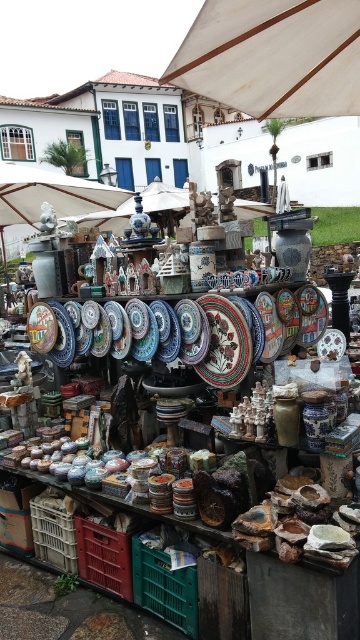
You are a customer at the market stall and want to place a small sculpture between the green plastic crate at lower center and the plastic crate at lower left. The sculpture is 20 inches wide. Do you think there is enough space between them to fit the sculpture?

The distance between the green plastic crate at lower center and the plastic crate at lower left is 23.44 inches. Since the sculpture is 20 inches wide, there is enough space to fit it between them.